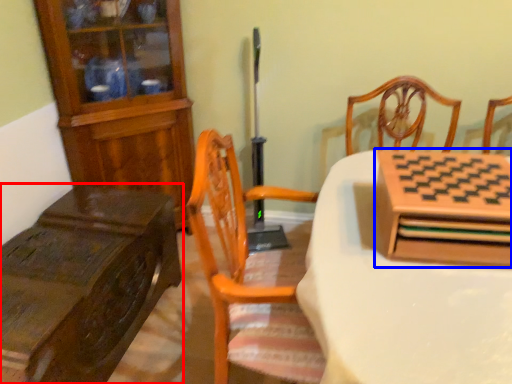
Question: Which object is closer to the camera taking this photo, table (highlighted by a red box) or cabinetry (highlighted by a blue box)?

Choices:
 (A) table
 (B) cabinetry

Answer: (B)